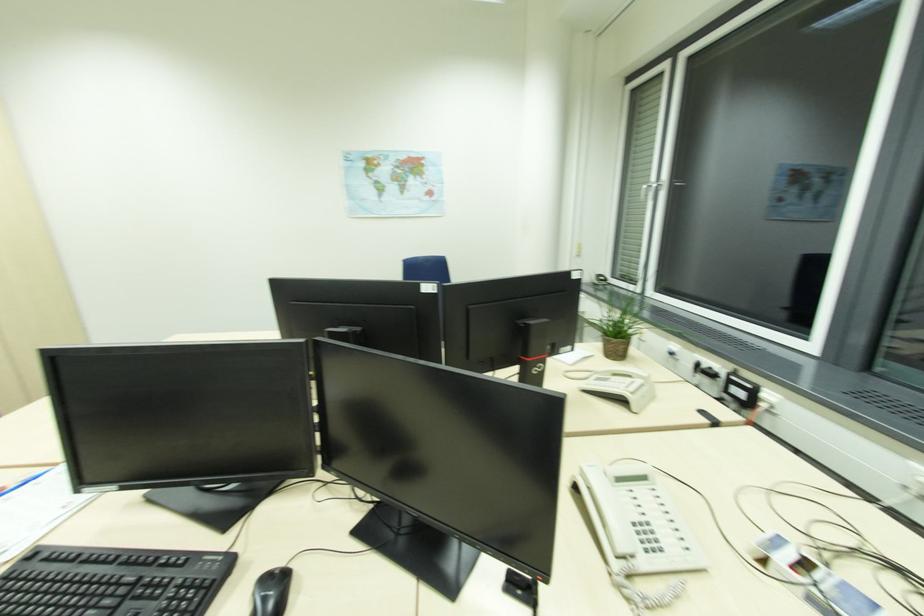
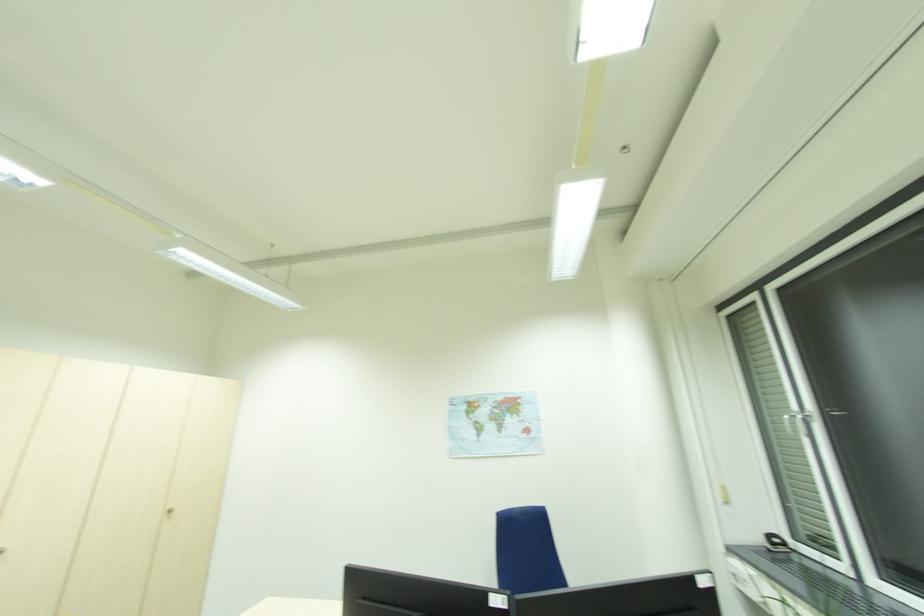
The images are taken continuously from a first-person perspective. In which direction is your viewpoint rotating?

The camera's rotation is toward left-up.